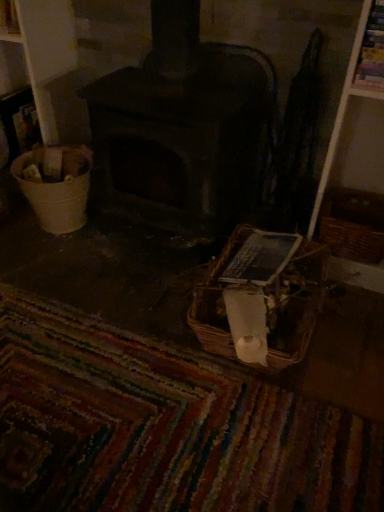
This screenshot has height=512, width=384. Find the location of `free location above dark gray stone wood burning stove at center (from a real-world perspective)`. free location above dark gray stone wood burning stove at center (from a real-world perspective) is located at coordinates pos(232,39).